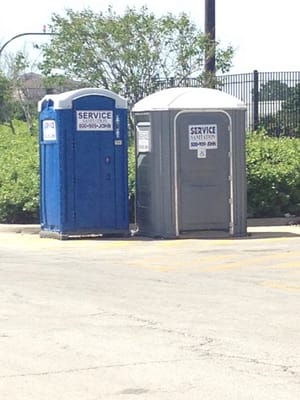
Where is `door`? door is located at coordinates (200, 210), (103, 168), (222, 118), (93, 98).